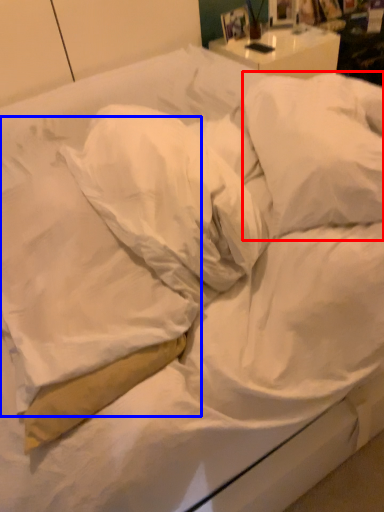
Question: Among these objects, which one is nearest to the camera, pillow (highlighted by a red box) or pillow (highlighted by a blue box)?

Choices:
 (A) pillow
 (B) pillow

Answer: (B)